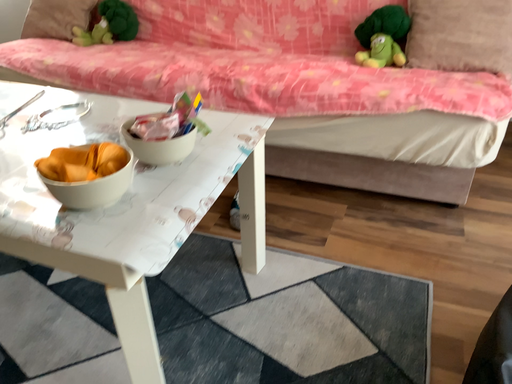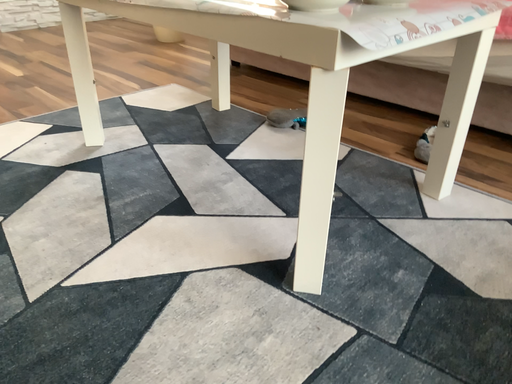
Question: Which way did the camera rotate in the video?

Choices:
 (A) rotated right
 (B) rotated left

Answer: (B)